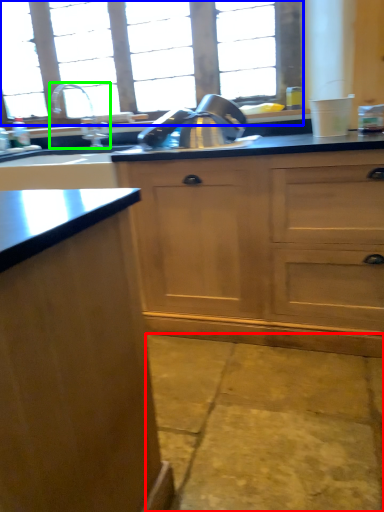
Question: Estimate the real-world distances between objects in this image. Which object is farther from concrete (highlighted by a red box), window (highlighted by a blue box) or tap (highlighted by a green box)?

Choices:
 (A) window
 (B) tap

Answer: (A)